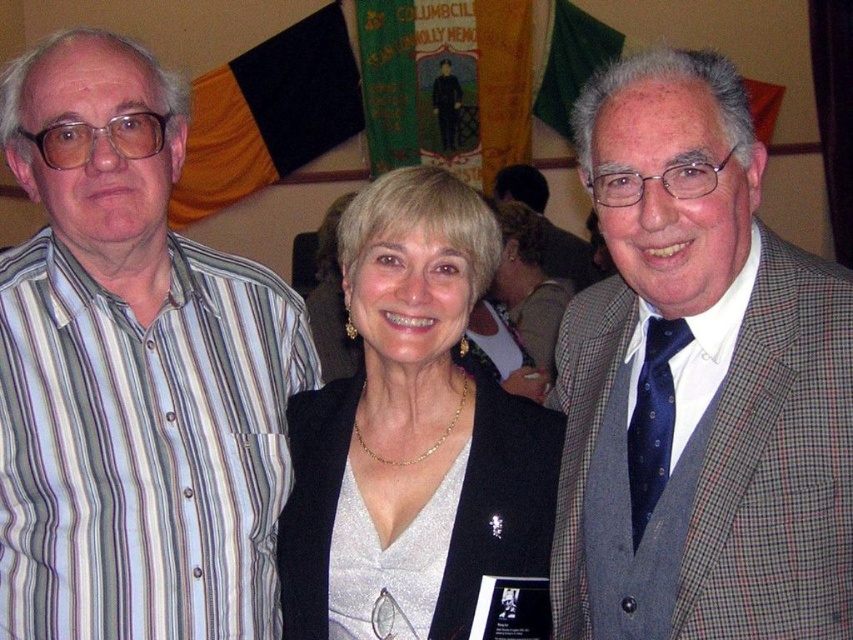
Question: Which of the following is the closest to the observer?

Choices:
 (A) (497, 282)
 (B) (544, 184)
 (C) (515, 410)
 (D) (276, 321)

Answer: (C)

Question: Which of the following is the farthest from the observer?

Choices:
 (A) (462, 324)
 (B) (525, 204)
 (C) (624, 474)

Answer: (B)

Question: Does striped cotton shirt at left come behind matte gray suit at center?

Choices:
 (A) yes
 (B) no

Answer: (B)

Question: Which of the following is the farthest from the observer?

Choices:
 (A) matte black jacket at center
 (B) silver metallic dress at center

Answer: (A)

Question: Does silver metallic dress at center appear under matte black jacket at center?

Choices:
 (A) no
 (B) yes

Answer: (B)

Question: Can you confirm if striped cotton shirt at left is positioned to the right of checkered wool suit at right?

Choices:
 (A) no
 (B) yes

Answer: (A)